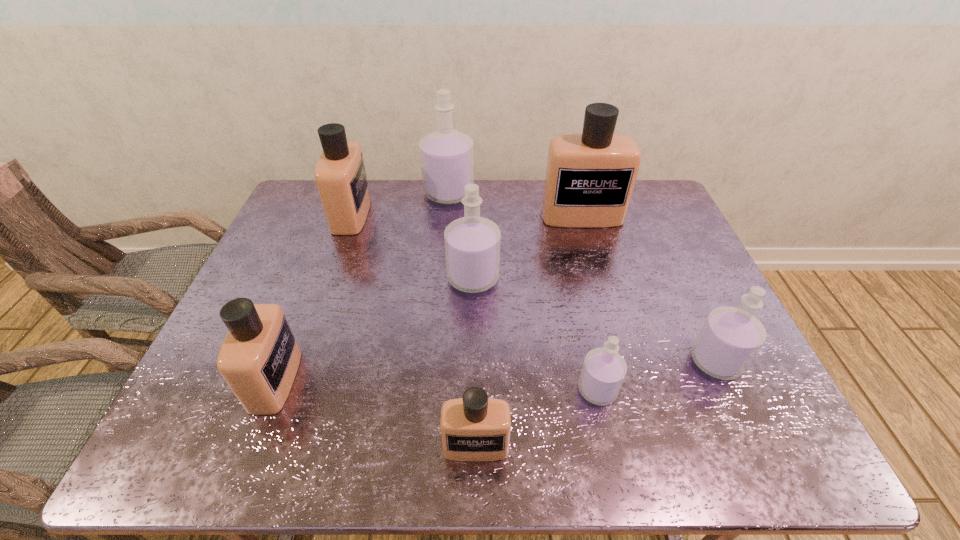
The image size is (960, 540). I want to click on free location that satisfies the following two spatial constraints: 1. on the back side of the smallest purple perfume; 2. on the front label of the second smallest beige perfume, so click(595, 380).

You are a GUI agent. You are given a task and a screenshot of the screen. Output one action in this format:
    pyautogui.click(x=<x>, y=<y>)
    Task: Click on the vacant space that satisfies the following two spatial constraints: 1. on the front side of the biggest purple perfume; 2. on the front label of the second nearest beige perfume
    This screenshot has height=540, width=960.
    Given the screenshot: What is the action you would take?
    pyautogui.click(x=432, y=380)

You are a GUI agent. You are given a task and a screenshot of the screen. Output one action in this format:
    pyautogui.click(x=<x>, y=<y>)
    Task: Click on the vacant space that satisfies the following two spatial constraints: 1. on the back side of the second farthest purple perfume; 2. on the front label of the second biggest beige perfume
    
    Given the screenshot: What is the action you would take?
    pyautogui.click(x=474, y=215)